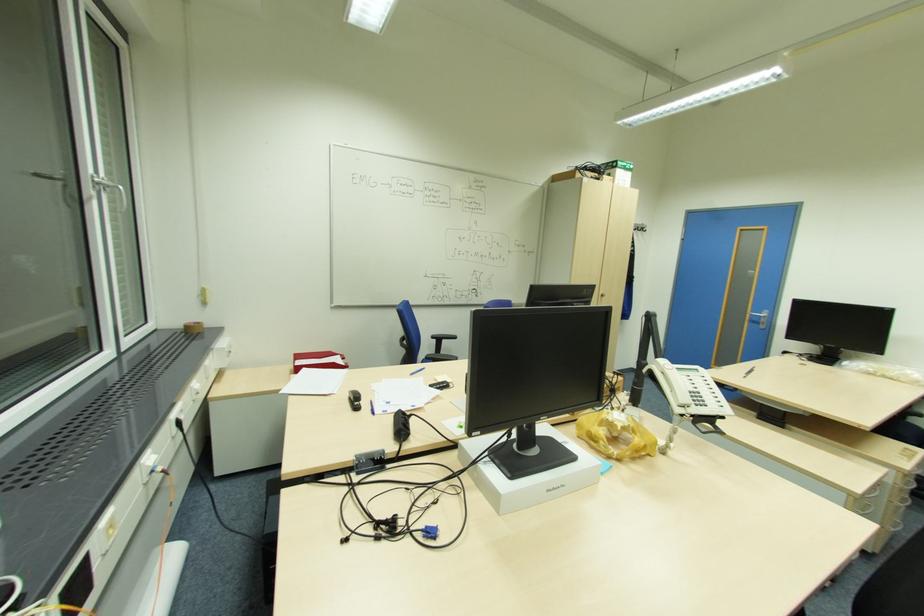
Where is `roll of brown tape`? Image resolution: width=924 pixels, height=616 pixels. roll of brown tape is located at coordinates (192, 328).